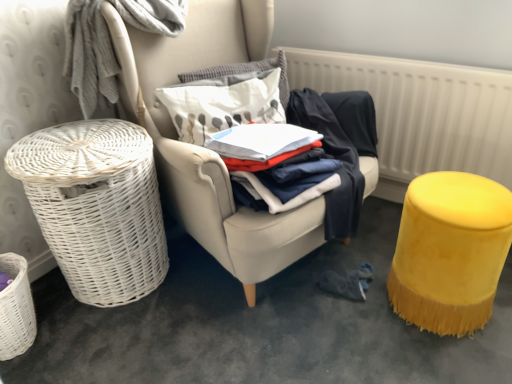
Question: Can you confirm if white textured pillow at center, which ranks as the first pillow in top-to-bottom order, is taller than white cotton shirt at center?

Choices:
 (A) yes
 (B) no

Answer: (B)

Question: Considering the relative sizes of white textured pillow at center, which is counted as the 2th pillow, starting from the bottom, and white cotton shirt at center in the image provided, is white textured pillow at center, which is counted as the 2th pillow, starting from the bottom, bigger than white cotton shirt at center?

Choices:
 (A) yes
 (B) no

Answer: (B)

Question: From the image's perspective, is white textured pillow at center, which ranks as the first pillow in top-to-bottom order, beneath white cotton shirt at center?

Choices:
 (A) yes
 (B) no

Answer: (B)

Question: From a real-world perspective, is white textured pillow at center, which is counted as the 2th pillow, starting from the bottom, located beneath white cotton shirt at center?

Choices:
 (A) yes
 (B) no

Answer: (B)

Question: Could you tell me if white textured pillow at center, which ranks as the first pillow in top-to-bottom order, is facing white cotton shirt at center?

Choices:
 (A) yes
 (B) no

Answer: (A)

Question: From the image's perspective, is white textured radiator at upper right above or below white textured pillow at center, which is counted as the 2th pillow, starting from the bottom?

Choices:
 (A) below
 (B) above

Answer: (A)

Question: In the image, is white textured radiator at upper right positioned in front of or behind white textured pillow at center, which ranks as the first pillow in top-to-bottom order?

Choices:
 (A) behind
 (B) front

Answer: (B)

Question: Would you say white textured radiator at upper right is to the left or to the right of white textured pillow at center, which is counted as the 2th pillow, starting from the bottom, in the picture?

Choices:
 (A) left
 (B) right

Answer: (B)

Question: From a real-world perspective, is white textured radiator at upper right above or below white textured pillow at center, which ranks as the first pillow in top-to-bottom order?

Choices:
 (A) below
 (B) above

Answer: (A)

Question: From a real-world perspective, is white fabric pillow at center, which is the 2th pillow from top to bottom, above or below white textured radiator at upper right?

Choices:
 (A) below
 (B) above

Answer: (B)

Question: In the image, is white fabric pillow at center, which is the 2th pillow from top to bottom, on the left side or the right side of white textured radiator at upper right?

Choices:
 (A) right
 (B) left

Answer: (B)

Question: From the image's perspective, is white fabric pillow at center, arranged as the first pillow when ordered from the bottom, above or below white textured radiator at upper right?

Choices:
 (A) above
 (B) below

Answer: (A)

Question: Considering the positions of point (199, 87) and point (329, 61), is point (199, 87) closer or farther from the camera than point (329, 61)?

Choices:
 (A) farther
 (B) closer

Answer: (B)

Question: From a real-world perspective, relative to white fabric pillow at center, arranged as the first pillow when ordered from the bottom, is white cotton shirt at center vertically above or below?

Choices:
 (A) above
 (B) below

Answer: (B)

Question: Considering the positions of white cotton shirt at center and white fabric pillow at center, arranged as the first pillow when ordered from the bottom, in the image, is white cotton shirt at center bigger or smaller than white fabric pillow at center, arranged as the first pillow when ordered from the bottom,?

Choices:
 (A) big
 (B) small

Answer: (B)